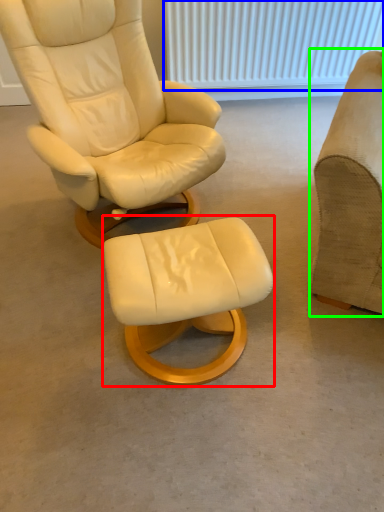
Question: Which object is the closest to the stool (highlighted by a red box)? Choose among these: radiator (highlighted by a blue box) or chair (highlighted by a green box).

Choices:
 (A) radiator
 (B) chair

Answer: (B)